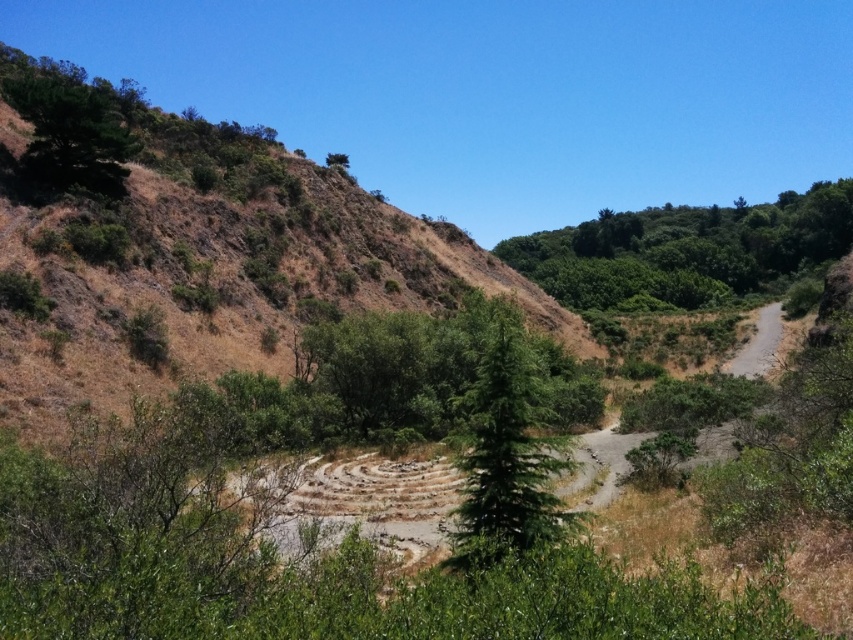
Question: Estimate the real-world distances between objects in this image. Which object is farther from the green leafy tree at upper right?

Choices:
 (A) green leafy tree at upper center
 (B) green matte tree at center

Answer: (B)

Question: Can you confirm if green leafy tree at upper right is wider than green leafy tree at upper center?

Choices:
 (A) no
 (B) yes

Answer: (B)

Question: Is green matte tree at center thinner than green leafy tree at upper center?

Choices:
 (A) yes
 (B) no

Answer: (A)

Question: Does green leafy tree at upper left have a greater width compared to green leafy tree at upper center?

Choices:
 (A) no
 (B) yes

Answer: (A)

Question: Which is farther from the brown/dry grass at upper left?

Choices:
 (A) green leafy tree at upper left
 (B) green leafy tree at upper center

Answer: (B)

Question: Based on their relative distances, which object is nearer to the green leafy tree at upper center?

Choices:
 (A) brown/dry grass at upper left
 (B) green matte tree at center
 (C) green leafy tree at upper left

Answer: (A)